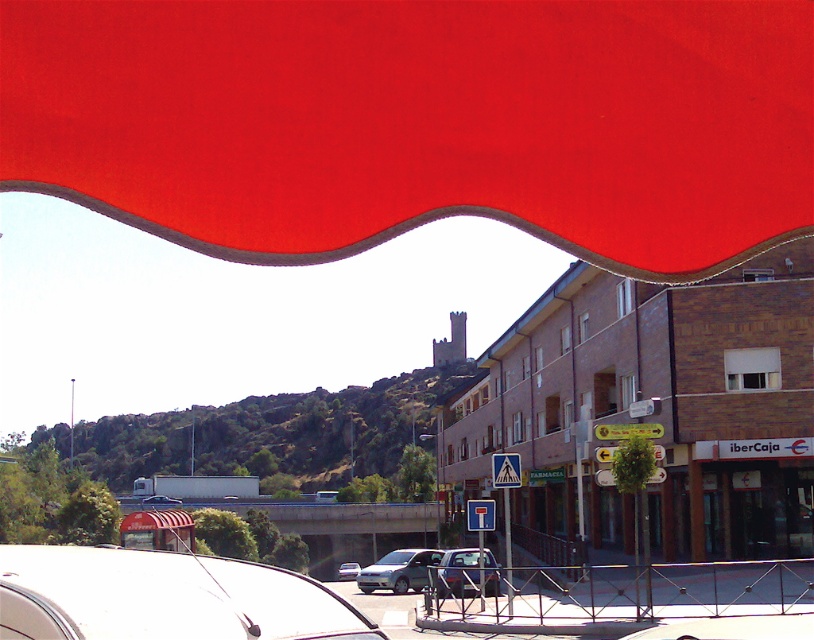
Does point (510, 60) come closer to viewer compared to point (340, 566)?

Yes.

Who is lower down, matte red awning at upper center or silver metallic sedan at center?

silver metallic sedan at center is below.

Locate an element on the screen. This screenshot has width=814, height=640. matte red awning at upper center is located at coordinates (419, 122).

Can you confirm if white matte car at lower left is wider than matte silver van at center?

In fact, white matte car at lower left might be narrower than matte silver van at center.

Between point (138, 592) and point (365, 577), which one is positioned in front?

Point (138, 592)

Is point (195, 564) closer to camera compared to point (419, 552)?

Yes, point (195, 564) is closer to viewer.

Find the location of a particular element. This screenshot has height=640, width=814. white matte car at lower left is located at coordinates (164, 596).

Does point (451, 570) come closer to viewer compared to point (337, 577)?

That is True.

Between point (454, 556) and point (355, 576), which one is positioned behind?

Positioned behind is point (355, 576).

Is point (462, 593) farther from camera compared to point (351, 564)?

No, (462, 593) is closer to viewer.

Image resolution: width=814 pixels, height=640 pixels. In order to click on metallic silver car at center in this screenshot , I will do `click(456, 572)`.